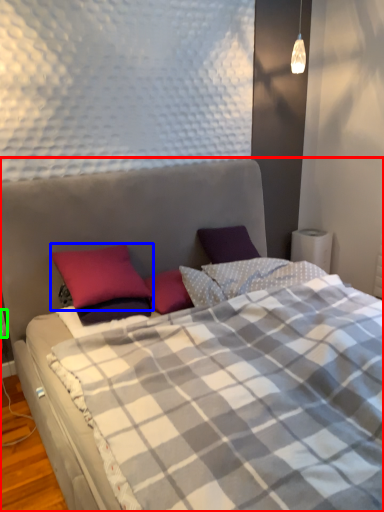
Question: Which object is positioned farthest from bed (highlighted by a red box)? Select from pillow (highlighted by a blue box) and electric outlet (highlighted by a green box).

Choices:
 (A) pillow
 (B) electric outlet

Answer: (B)